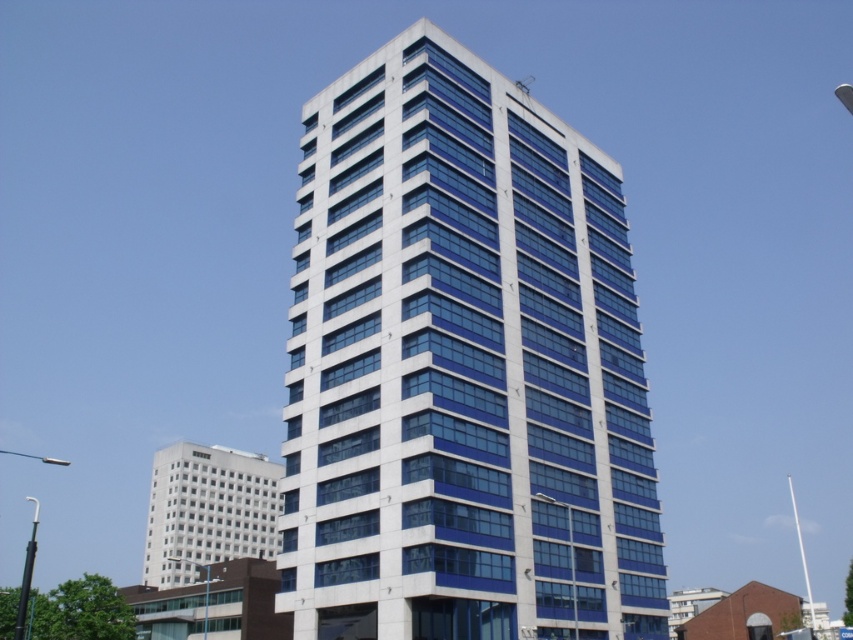
Is white glass building at center below white glass building at lower left?

No, white glass building at center is not below white glass building at lower left.

Is white glass building at center wider than white glass building at lower left?

No, white glass building at center is not wider than white glass building at lower left.

What are the coordinates of `white glass building at center` in the screenshot? It's located at (462, 368).